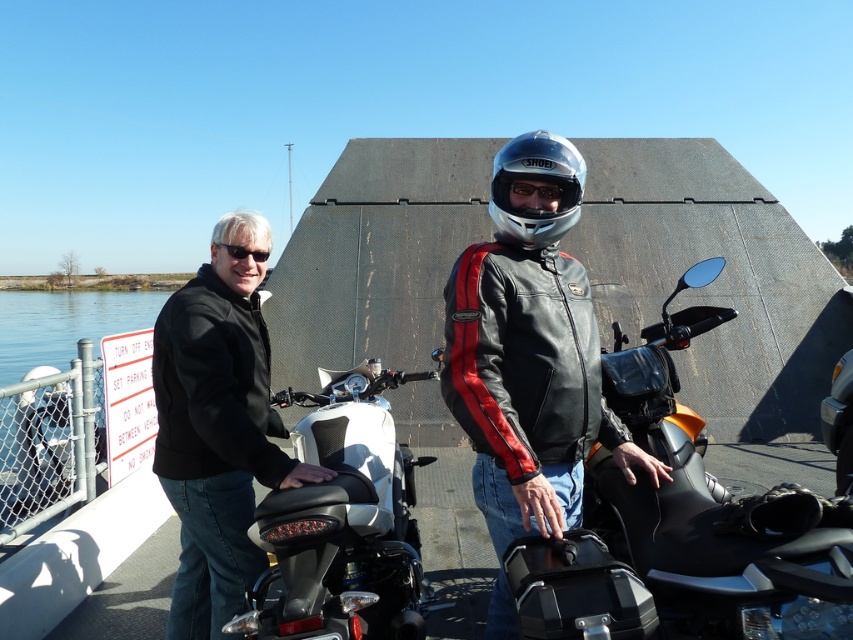
At what (x,y) coordinates should I click in order to perform the action: click on orange matte/black textured seat at center. Please return your answer as a coordinate pair (x, y). This screenshot has width=853, height=640. Looking at the image, I should click on (711, 508).

In the scene shown: Between orange matte/black textured seat at center and silver metallic helmet at center, which one has more height?

Standing taller between the two is orange matte/black textured seat at center.

Who is more distant from viewer, (666,541) or (531,236)?

The point (666,541) is more distant.

Locate an element on the screen. The image size is (853, 640). orange matte/black textured seat at center is located at coordinates (711, 508).

Is black leather jacket at center below black leather jacket at left?

Incorrect, black leather jacket at center is not positioned below black leather jacket at left.

Who is higher up, black leather jacket at center or black leather jacket at left?

black leather jacket at center is higher up.

In order to click on black leather jacket at center in this screenshot , I will do `click(529, 358)`.

The height and width of the screenshot is (640, 853). What are the coordinates of `black leather jacket at center` in the screenshot? It's located at (529, 358).

Is orange matte/black textured seat at center to the left of black leather jacket at left from the viewer's perspective?

No, orange matte/black textured seat at center is not to the left of black leather jacket at left.

Between orange matte/black textured seat at center and black leather jacket at left, which one appears on the left side from the viewer's perspective?

Positioned to the left is black leather jacket at left.

Identify the location of orange matte/black textured seat at center. 711,508.

Image resolution: width=853 pixels, height=640 pixels. I want to click on orange matte/black textured seat at center, so click(x=711, y=508).